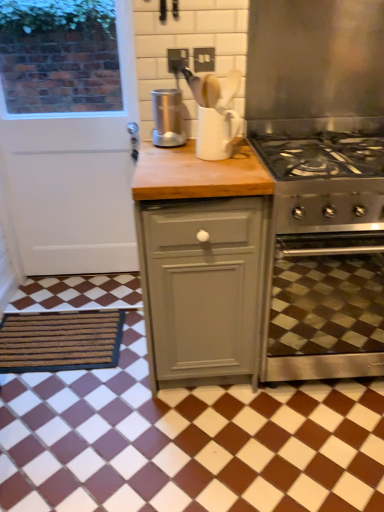
Question: From a real-world perspective, is stainless steel exhaust hood at upper right physically above white glossy mug at upper center?

Choices:
 (A) yes
 (B) no

Answer: (A)

Question: Is white glossy mug at upper center at the back of stainless steel exhaust hood at upper right?

Choices:
 (A) no
 (B) yes

Answer: (A)

Question: Is stainless steel exhaust hood at upper right positioned beyond the bounds of white glossy mug at upper center?

Choices:
 (A) no
 (B) yes

Answer: (B)

Question: Considering the relative sizes of stainless steel exhaust hood at upper right and white glossy mug at upper center in the image provided, is stainless steel exhaust hood at upper right shorter than white glossy mug at upper center?

Choices:
 (A) no
 (B) yes

Answer: (A)

Question: Are stainless steel exhaust hood at upper right and white glossy mug at upper center making contact?

Choices:
 (A) yes
 (B) no

Answer: (B)

Question: Is matte gray cabinet at center inside the boundaries of stainless steel oven at right, or outside?

Choices:
 (A) inside
 (B) outside

Answer: (B)

Question: Would you say matte gray cabinet at center is to the left or to the right of stainless steel oven at right in the picture?

Choices:
 (A) left
 (B) right

Answer: (A)

Question: In terms of width, does matte gray cabinet at center look wider or thinner when compared to stainless steel oven at right?

Choices:
 (A) wide
 (B) thin

Answer: (B)

Question: Looking at the image, does matte gray cabinet at center seem bigger or smaller compared to stainless steel oven at right?

Choices:
 (A) big
 (B) small

Answer: (B)

Question: Is stainless steel oven at right in front of or behind stainless steel exhaust hood at upper right in the image?

Choices:
 (A) front
 (B) behind

Answer: (B)

Question: Is stainless steel oven at right bigger or smaller than stainless steel exhaust hood at upper right?

Choices:
 (A) big
 (B) small

Answer: (A)

Question: From a real-world perspective, is stainless steel oven at right positioned above or below stainless steel exhaust hood at upper right?

Choices:
 (A) below
 (B) above

Answer: (A)

Question: From the image's perspective, is stainless steel oven at right above or below stainless steel exhaust hood at upper right?

Choices:
 (A) above
 (B) below

Answer: (B)

Question: From a real-world perspective, is brown textured mat at lower left above or below stainless steel exhaust hood at upper right?

Choices:
 (A) above
 (B) below

Answer: (B)

Question: From the image's perspective, is brown textured mat at lower left located above or below stainless steel exhaust hood at upper right?

Choices:
 (A) below
 (B) above

Answer: (A)